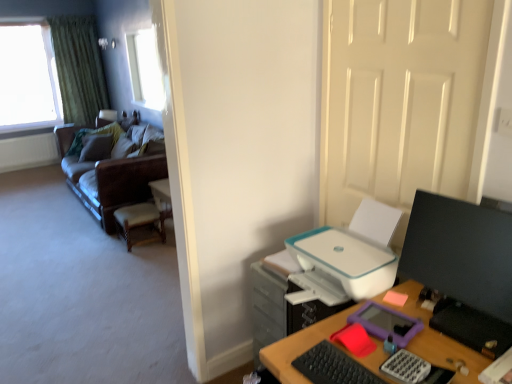
Identify the location of vacant space in front of brown leather couch at left. (77, 269).